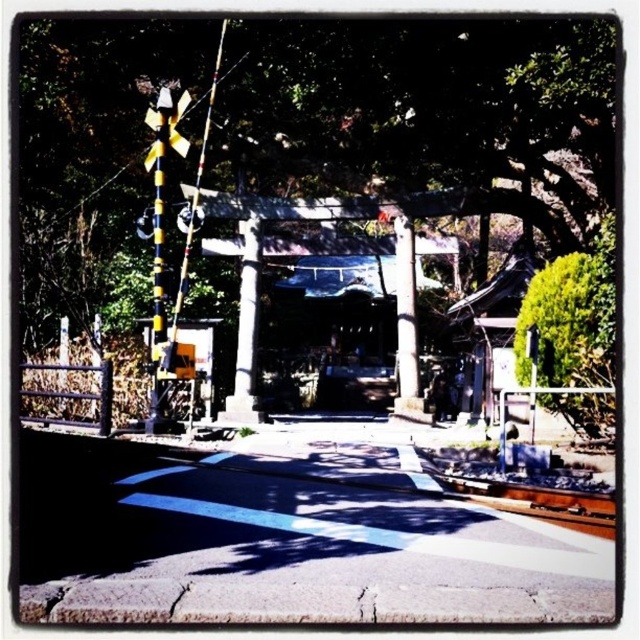
Question: Is the position of green leafy tree at upper center more distant than that of yellow/black striped traffic light at upper left?

Choices:
 (A) no
 (B) yes

Answer: (A)

Question: Which point is farther from the camera taking this photo?

Choices:
 (A) (172, 118)
 (B) (336, 198)
 (C) (256, 422)
 (D) (396, 368)

Answer: (D)

Question: Does green leafy tree at upper center appear on the right side of white stone pillar at center?

Choices:
 (A) no
 (B) yes

Answer: (B)

Question: Which of these objects is positioned farthest from the white glossy pole at center?

Choices:
 (A) yellow/black striped traffic light at upper left
 (B) white stone pillar at center

Answer: (A)

Question: Estimate the real-world distances between objects in this image. Which object is closer to the white stone pillar at center?

Choices:
 (A) yellow/black striped traffic light at upper left
 (B) green leafy tree at upper center

Answer: (A)

Question: Can you confirm if white glossy pole at center is positioned to the left of yellow/black striped traffic light at upper left?

Choices:
 (A) yes
 (B) no

Answer: (B)